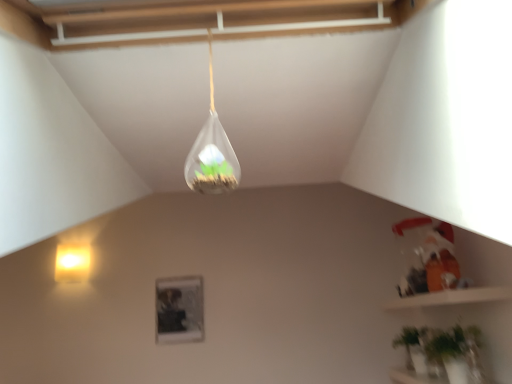
Question: In terms of width, does green matte plant at lower right look wider or thinner when compared to matte yellow wall sconce at left, acting as the 1th lamp starting from the back?

Choices:
 (A) thin
 (B) wide

Answer: (B)

Question: Does point (450, 345) appear closer or farther from the camera than point (67, 251)?

Choices:
 (A) farther
 (B) closer

Answer: (B)

Question: Considering the real-world distances, which object is closest to the transparent glass terrarium at upper center, the 1th lamp from the right?

Choices:
 (A) matte yellow wall sconce at left, acting as the 2th lamp starting from the front
 (B) green matte plant at lower right

Answer: (B)

Question: Considering the real-world distances, which object is closest to the transparent glass terrarium at upper center, the 1th lamp from the right?

Choices:
 (A) green matte plant at lower right
 (B) matte yellow wall sconce at left, which ranks as the first lamp in left-to-right order

Answer: (A)